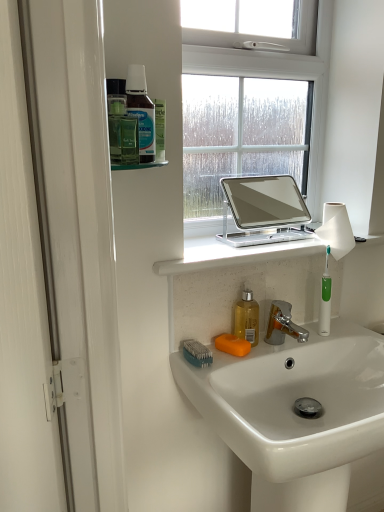
Question: From a real-world perspective, is white glossy sink at lower center under green plastic toothbrush at right?

Choices:
 (A) yes
 (B) no

Answer: (A)

Question: Is white glossy sink at lower center wider than green plastic toothbrush at right?

Choices:
 (A) no
 (B) yes

Answer: (B)

Question: Does white glossy sink at lower center lie in front of green plastic toothbrush at right?

Choices:
 (A) yes
 (B) no

Answer: (A)

Question: Is green plastic toothbrush at right a part of white glossy sink at lower center?

Choices:
 (A) yes
 (B) no

Answer: (B)

Question: Is white glossy sink at lower center completely or partially outside of green plastic toothbrush at right?

Choices:
 (A) yes
 (B) no

Answer: (A)

Question: Visually, is white glossy sink at lower center positioned to the left or to the right of translucent plastic bottle at upper left, the 1th mouthwash positioned from the front?

Choices:
 (A) right
 (B) left

Answer: (A)

Question: In terms of size, does white glossy sink at lower center appear bigger or smaller than translucent plastic bottle at upper left, the first mouthwash when ordered from left to right?

Choices:
 (A) small
 (B) big

Answer: (B)

Question: Considering their positions, is white glossy sink at lower center located in front of or behind translucent plastic bottle at upper left, arranged as the second mouthwash when viewed from the right?

Choices:
 (A) behind
 (B) front

Answer: (B)

Question: In terms of height, does white glossy sink at lower center look taller or shorter compared to translucent plastic bottle at upper left, the first mouthwash viewed from the top?

Choices:
 (A) tall
 (B) short

Answer: (A)

Question: Is point (246, 322) positioned closer to the camera than point (190, 344)?

Choices:
 (A) closer
 (B) farther

Answer: (B)

Question: From a real-world perspective, is translucent yellow liquid at sink, the 1th mouthwash when ordered from right to left, positioned above or below green plastic toothbrush at lower center?

Choices:
 (A) above
 (B) below

Answer: (A)

Question: In the image, is translucent yellow liquid at sink, positioned as the 2th mouthwash in top-to-bottom order, positioned in front of or behind green plastic toothbrush at lower center?

Choices:
 (A) front
 (B) behind

Answer: (B)

Question: From the image's perspective, is translucent yellow liquid at sink, positioned as the 2th mouthwash in left-to-right order, located above or below green plastic toothbrush at lower center?

Choices:
 (A) above
 (B) below

Answer: (A)

Question: Visually, is translucent yellow liquid at sink, acting as the 1th mouthwash starting from the back, positioned to the left or to the right of orange matte soap at sink?

Choices:
 (A) left
 (B) right

Answer: (B)

Question: Do you think translucent yellow liquid at sink, positioned as the 2th mouthwash in left-to-right order, is within orange matte soap at sink, or outside of it?

Choices:
 (A) inside
 (B) outside

Answer: (B)